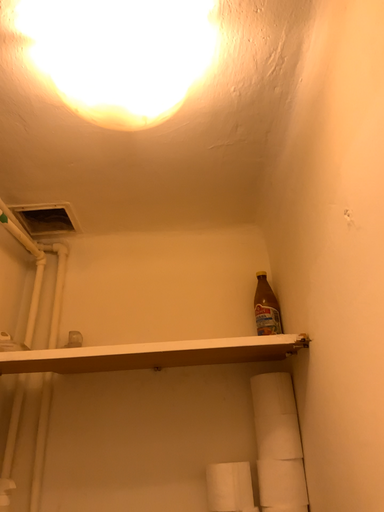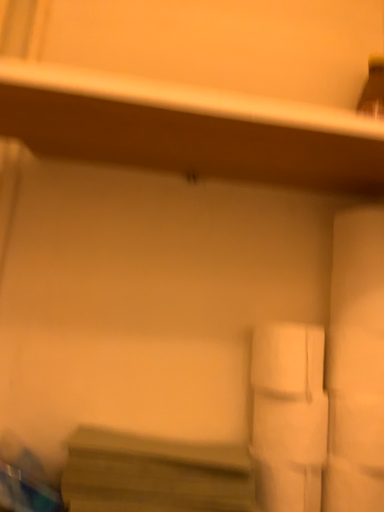
Question: How did the camera likely rotate when shooting the video?

Choices:
 (A) rotated upward
 (B) rotated downward

Answer: (B)